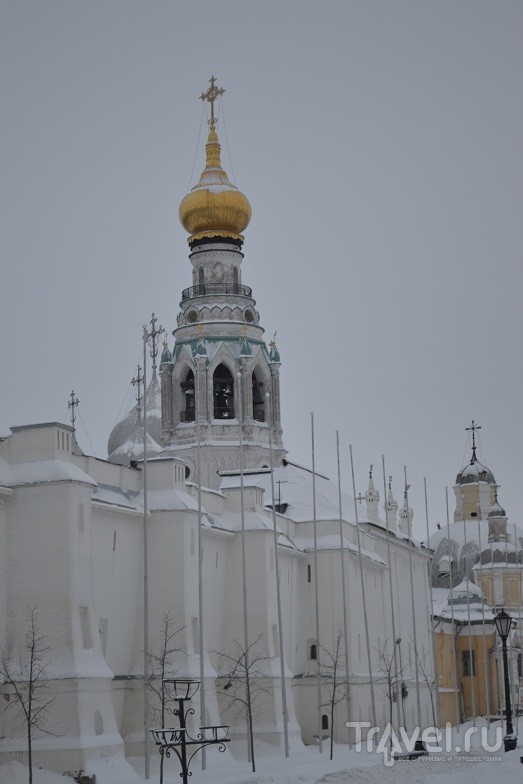
Where is `vents`? This screenshot has width=523, height=784. vents is located at coordinates (60, 441), (177, 474), (256, 495).